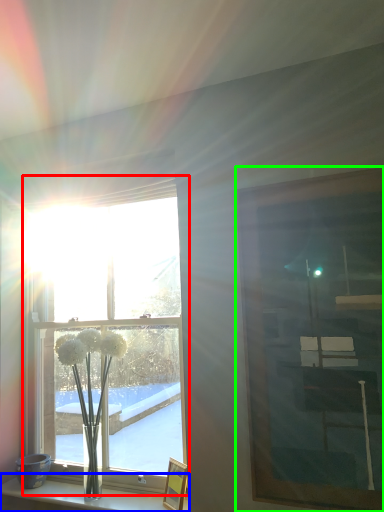
Question: Which is farther away from window (highlighted by a red box)? shelf (highlighted by a blue box) or picture frame (highlighted by a green box)?

Choices:
 (A) shelf
 (B) picture frame

Answer: (B)